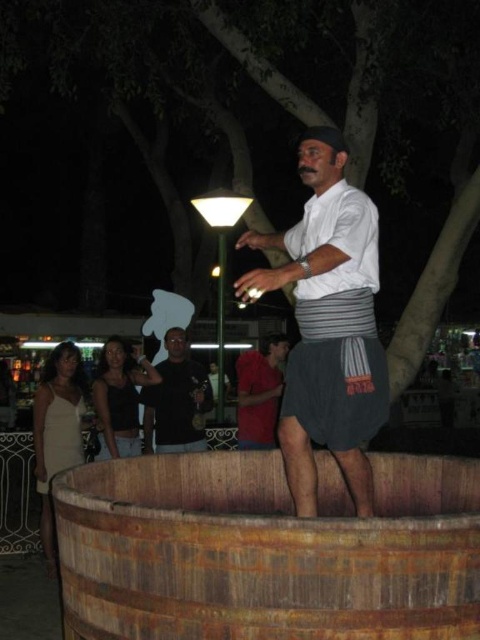
Can you confirm if rusty wood barrel at lower center is thinner than white satin dress at lower left?

Incorrect, rusty wood barrel at lower center's width is not less than white satin dress at lower left's.

Between point (431, 600) and point (44, 417), which one is positioned behind?

The point (44, 417) is behind.

Where is `rusty wood barrel at lower center`? The image size is (480, 640). rusty wood barrel at lower center is located at coordinates (267, 550).

Does point (286, 604) come closer to viewer compared to point (317, 221)?

That is True.

Which of these two, rusty wood barrel at lower center or white cotton shirt at center, stands shorter?

With less height is rusty wood barrel at lower center.

Identify the location of rusty wood barrel at lower center. This screenshot has height=640, width=480. (267, 550).

Is black matte shirt at center shorter than white satin dress at lower left?

Incorrect, black matte shirt at center's height does not fall short of white satin dress at lower left's.

From the picture: Who is more distant from viewer, (154, 413) or (71, 422)?

The point (154, 413) is more distant.

Locate an element on the screen. black matte shirt at center is located at coordinates (177, 401).